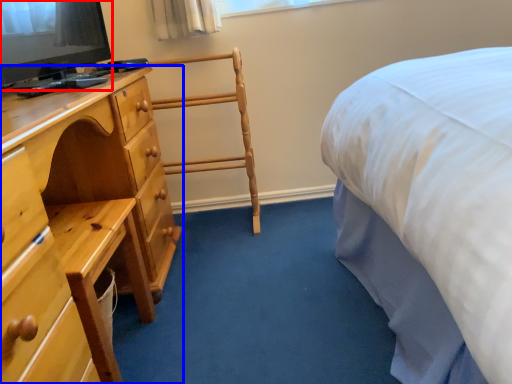
Question: Which point is further to the camera, television (highlighted by a red box) or chest of drawers (highlighted by a blue box)?

Choices:
 (A) television
 (B) chest of drawers

Answer: (A)